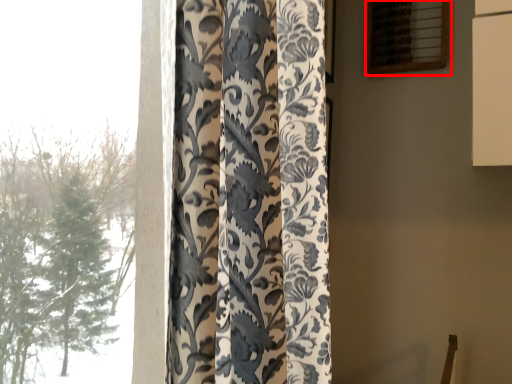
Question: Considering the relative positions of window (annotated by the red box) and curtain in the image provided, where is window (annotated by the red box) located with respect to the staircase?

Choices:
 (A) right
 (B) left

Answer: (A)